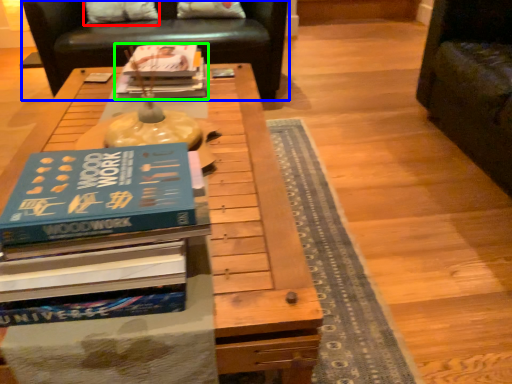
Question: Considering the real-world distances, which object is closest to pillow (highlighted by a red box)? chair (highlighted by a blue box) or book (highlighted by a green box).

Choices:
 (A) chair
 (B) book

Answer: (A)